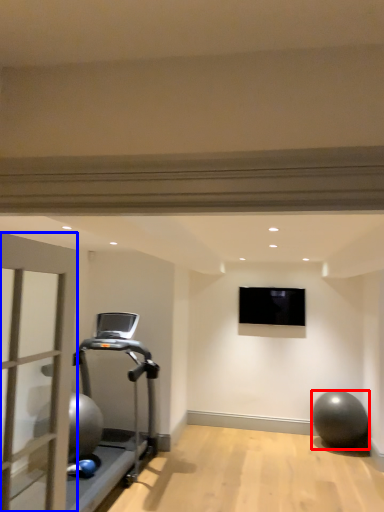
Question: Among these objects, which one is nearest to the camera, ball (highlighted by a red box) or garage door (highlighted by a blue box)?

Choices:
 (A) ball
 (B) garage door

Answer: (B)